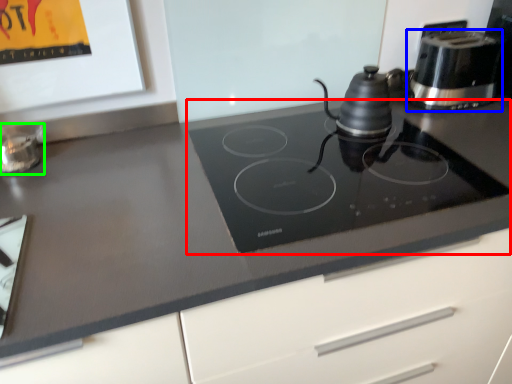
Question: Based on their relative distances, which object is nearer to gas stove (highlighted by a red box)? Choose from kitchen appliance (highlighted by a blue box) and appliance (highlighted by a green box).

Choices:
 (A) kitchen appliance
 (B) appliance

Answer: (A)